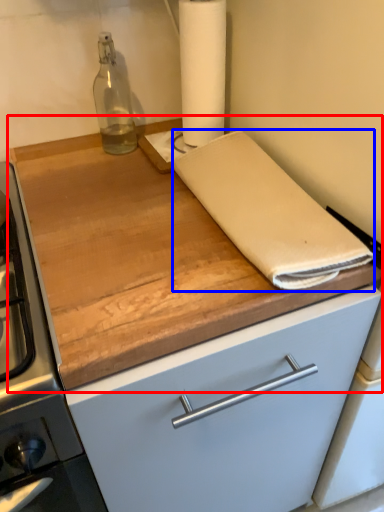
Question: Among these objects, which one is farthest to the camera, countertop (highlighted by a red box) or linen (highlighted by a blue box)?

Choices:
 (A) countertop
 (B) linen

Answer: (B)